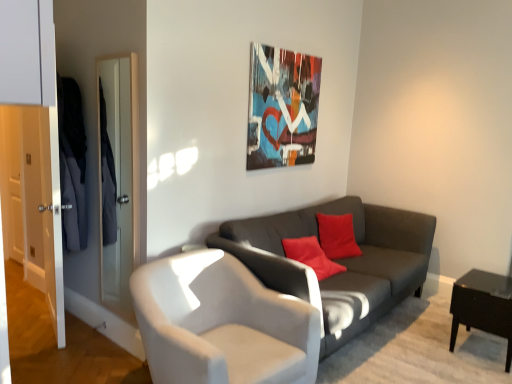
Question: From the image's perspective, is metallic abstract art at upper center beneath black glossy side table at lower right?

Choices:
 (A) yes
 (B) no

Answer: (B)

Question: Is metallic abstract art at upper center looking in the opposite direction of black glossy side table at lower right?

Choices:
 (A) no
 (B) yes

Answer: (A)

Question: Is metallic abstract art at upper center thinner than black glossy side table at lower right?

Choices:
 (A) no
 (B) yes

Answer: (B)

Question: Considering the relative sizes of metallic abstract art at upper center and black glossy side table at lower right in the image provided, is metallic abstract art at upper center wider than black glossy side table at lower right?

Choices:
 (A) no
 (B) yes

Answer: (A)

Question: Is metallic abstract art at upper center shorter than black glossy side table at lower right?

Choices:
 (A) yes
 (B) no

Answer: (B)

Question: From the image's perspective, relative to metallic abstract art at upper center, is black glossy side table at lower right above or below?

Choices:
 (A) above
 (B) below

Answer: (B)

Question: Considering their positions, is black glossy side table at lower right located in front of or behind metallic abstract art at upper center?

Choices:
 (A) front
 (B) behind

Answer: (A)

Question: Based on their positions, is black glossy side table at lower right located to the left or right of metallic abstract art at upper center?

Choices:
 (A) right
 (B) left

Answer: (A)

Question: Is point (470, 296) closer or farther from the camera than point (264, 52)?

Choices:
 (A) farther
 (B) closer

Answer: (B)

Question: From a real-world perspective, is dark gray fabric couch at center physically located above or below metallic abstract art at upper center?

Choices:
 (A) above
 (B) below

Answer: (B)

Question: Is dark gray fabric couch at center in front of or behind metallic abstract art at upper center in the image?

Choices:
 (A) front
 (B) behind

Answer: (A)

Question: From their relative heights in the image, would you say dark gray fabric couch at center is taller or shorter than metallic abstract art at upper center?

Choices:
 (A) short
 (B) tall

Answer: (A)

Question: In terms of width, does dark gray fabric couch at center look wider or thinner when compared to metallic abstract art at upper center?

Choices:
 (A) thin
 (B) wide

Answer: (B)

Question: In the image, is metallic abstract art at upper center positioned in front of or behind white leather chair at center?

Choices:
 (A) behind
 (B) front

Answer: (A)

Question: Is metallic abstract art at upper center spatially inside white leather chair at center, or outside of it?

Choices:
 (A) outside
 (B) inside

Answer: (A)